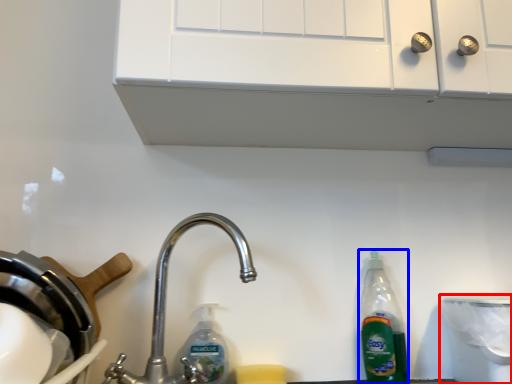
Question: Among these objects, which one is nearest to the camera, appliance (highlighted by a red box) or bottle (highlighted by a blue box)?

Choices:
 (A) appliance
 (B) bottle

Answer: (A)